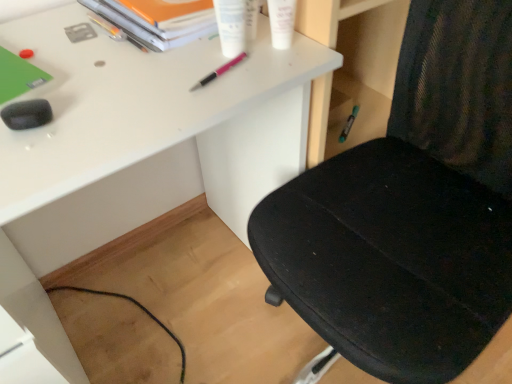
You are a GUI agent. You are given a task and a screenshot of the screen. Output one action in this format:
    pyautogui.click(x=<x>, y=<y>)
    Task: Click on the free space in front of white matte tube at upper center, the fifth stationery from the left
    Image resolution: width=512 pixels, height=384 pixels.
    Given the screenshot: What is the action you would take?
    pyautogui.click(x=254, y=78)